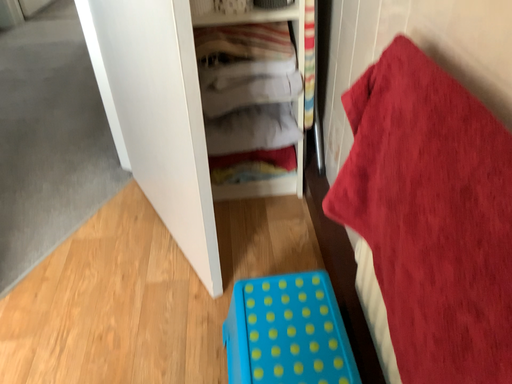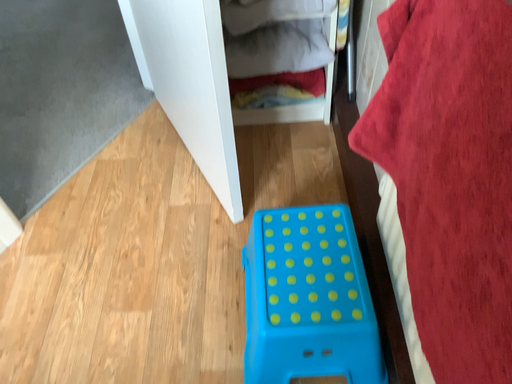
Question: Which way did the camera rotate in the video?

Choices:
 (A) rotated downward
 (B) rotated upward

Answer: (A)